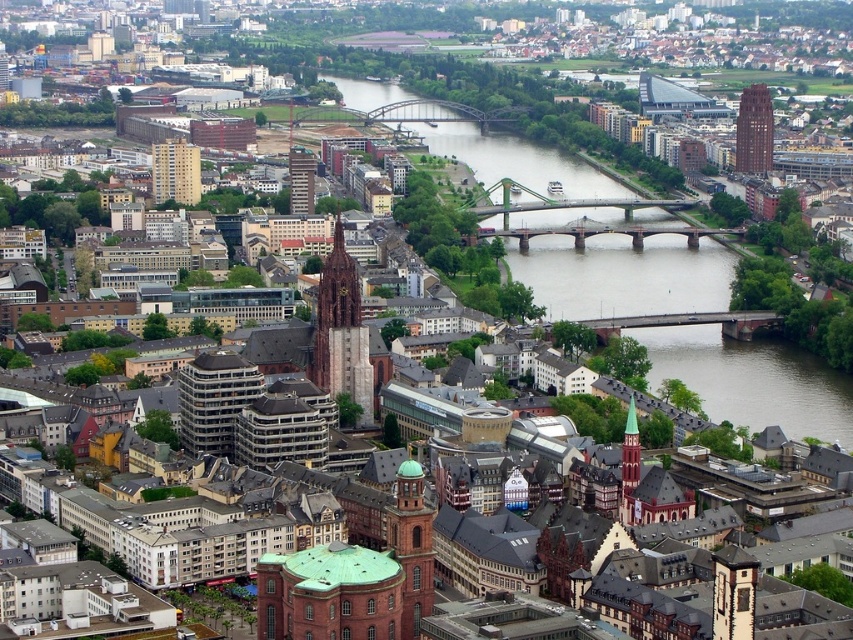
In the scene shown: How far apart are greenish-brown stone church steeple at center-right and metallic glass tower at center?

greenish-brown stone church steeple at center-right and metallic glass tower at center are 194.82 meters apart from each other.

You are a GUI agent. You are given a task and a screenshot of the screen. Output one action in this format:
    pyautogui.click(x=<x>, y=<y>)
    Task: Click on the greenish-brown stone church steeple at center-right
    
    Given the screenshot: What is the action you would take?
    pyautogui.click(x=630, y=465)

Is brown stone bridge at center below greenish-brown stone church steeple at center-right?

Incorrect, brown stone bridge at center is not positioned below greenish-brown stone church steeple at center-right.

Is brown stone bridge at center positioned in front of greenish-brown stone church steeple at center-right?

No, it is not.

Who is more forward, (715, 310) or (627, 433)?

Point (627, 433)

Image resolution: width=853 pixels, height=640 pixels. Identify the location of brown stone bridge at center. (624, 275).

The height and width of the screenshot is (640, 853). I want to click on brown stone bridge at center, so click(x=624, y=275).

Can you confirm if brown stone bridge at center is wider than glassy reflective skyscraper at upper right?

Indeed, brown stone bridge at center has a greater width compared to glassy reflective skyscraper at upper right.

Identify the location of brown stone bridge at center. (624, 275).